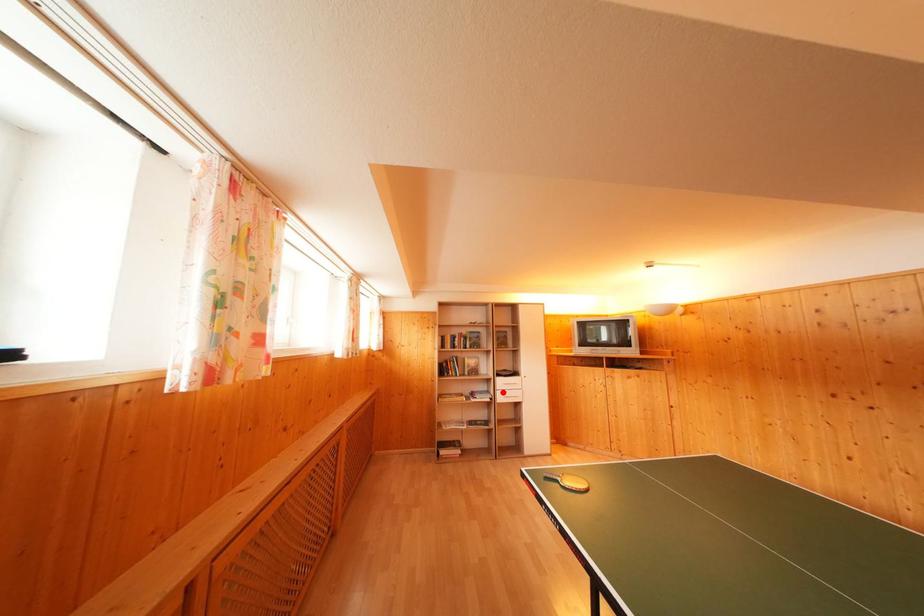
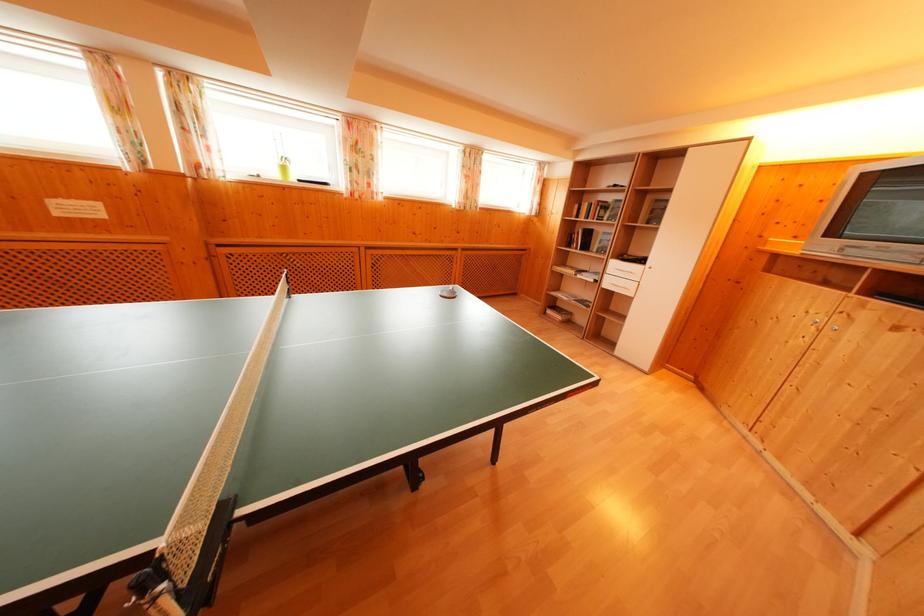
Question: I am providing you with two images of the same scene from different viewpoints. A red point is shown in image1. For the corresponding object point in image2, is it positioned nearer or farther from the camera?

Choices:
 (A) Nearer
 (B) Farther

Answer: (A)